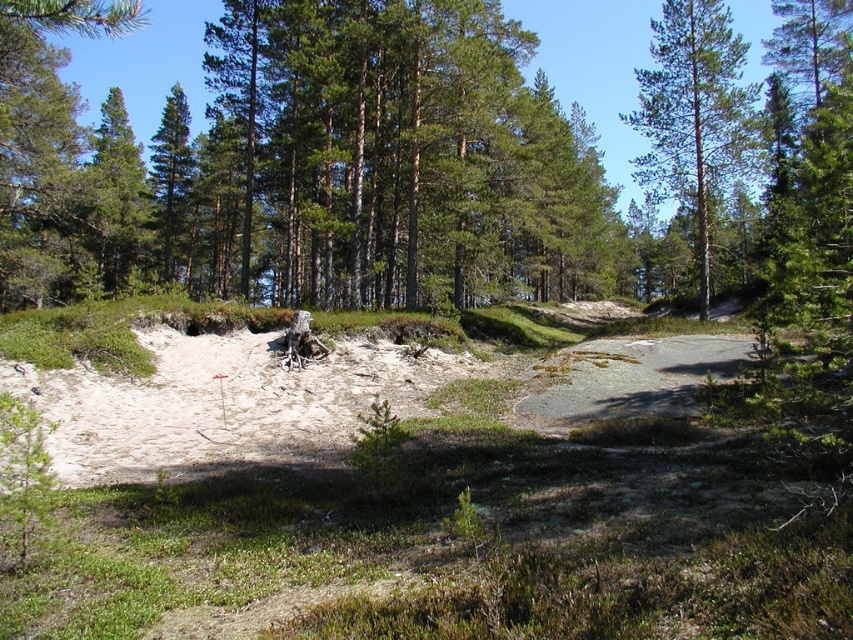
Is point (431, 381) less distant than point (184, 211)?

Yes, point (431, 381) is closer to viewer.

Who is lower down, sandy/grainy sand at center or green matte tree at center?

sandy/grainy sand at center is lower down.

Which is in front, point (132, 384) or point (154, 150)?

Point (132, 384)

Identify the location of sandy/grainy sand at center. point(221,403).

Does sandy/grainy sand at center appear on the right side of green textured pine tree at upper center?

In fact, sandy/grainy sand at center is to the left of green textured pine tree at upper center.

Is sandy/grainy sand at center taller than green textured pine tree at upper center?

Incorrect, sandy/grainy sand at center's height is not larger of green textured pine tree at upper center's.

Who is more forward, (70, 371) or (726, 106)?

Point (70, 371) is more forward.

Locate an element on the screen. The height and width of the screenshot is (640, 853). sandy/grainy sand at center is located at coordinates coord(221,403).

Between green textured pine tree at upper center and green matte tree at center, which one has more height?

green textured pine tree at upper center

Who is higher up, green textured pine tree at upper center or green matte tree at center?

green textured pine tree at upper center

Between point (714, 193) and point (189, 182), which one is positioned behind?

The point (189, 182) is behind.

This screenshot has height=640, width=853. Identify the location of green textured pine tree at upper center. (694, 113).